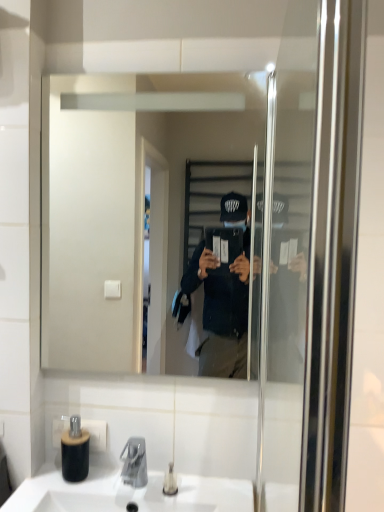
Question: Is white ceramic sink at lower center surrounded by clear plastic bottle at lower center?

Choices:
 (A) no
 (B) yes

Answer: (A)

Question: Is clear plastic bottle at lower center to the left of white ceramic sink at lower center from the viewer's perspective?

Choices:
 (A) no
 (B) yes

Answer: (A)

Question: Does clear plastic bottle at lower center have a smaller size compared to white ceramic sink at lower center?

Choices:
 (A) no
 (B) yes

Answer: (B)

Question: Are clear plastic bottle at lower center and white ceramic sink at lower center far apart?

Choices:
 (A) yes
 (B) no

Answer: (B)

Question: Is clear plastic bottle at lower center taller than white ceramic sink at lower center?

Choices:
 (A) no
 (B) yes

Answer: (A)

Question: Considering the relative sizes of clear plastic bottle at lower center and white ceramic sink at lower center in the image provided, is clear plastic bottle at lower center thinner than white ceramic sink at lower center?

Choices:
 (A) no
 (B) yes

Answer: (B)

Question: Considering the relative sizes of clear glass mirror at center and clear plastic bottle at lower center in the image provided, is clear glass mirror at center wider than clear plastic bottle at lower center?

Choices:
 (A) no
 (B) yes

Answer: (A)

Question: Is clear glass mirror at center to the left of clear plastic bottle at lower center from the viewer's perspective?

Choices:
 (A) no
 (B) yes

Answer: (B)

Question: Can clear plastic bottle at lower center be found inside clear glass mirror at center?

Choices:
 (A) yes
 (B) no

Answer: (B)

Question: Are clear glass mirror at center and clear plastic bottle at lower center far apart?

Choices:
 (A) no
 (B) yes

Answer: (A)

Question: Can you confirm if clear glass mirror at center is taller than clear plastic bottle at lower center?

Choices:
 (A) yes
 (B) no

Answer: (A)

Question: Is clear glass mirror at center facing away from clear plastic bottle at lower center?

Choices:
 (A) no
 (B) yes

Answer: (A)

Question: Is black matte bottle at lower left next to clear glass mirror at center?

Choices:
 (A) no
 (B) yes

Answer: (A)